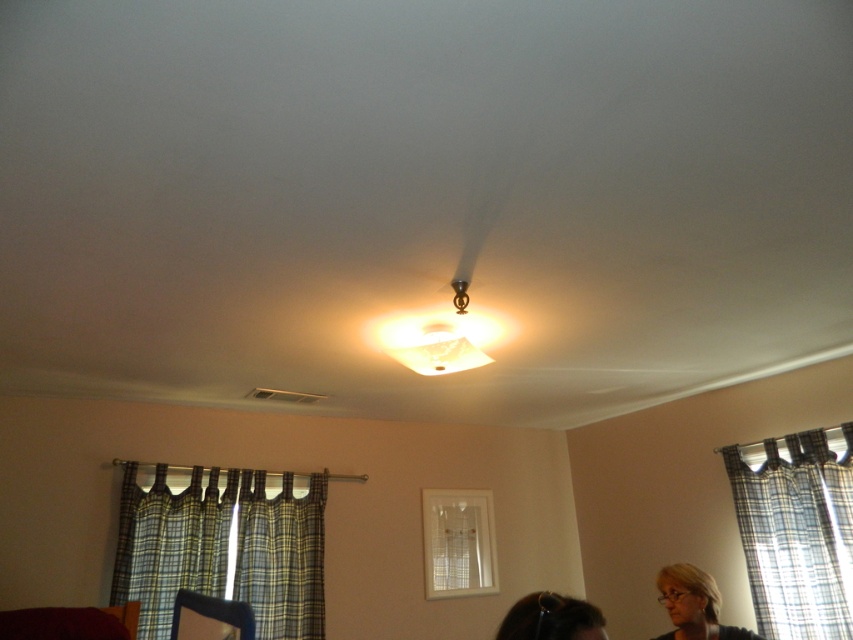
Is plaid fabric curtain at lower left positioned at the back of matte black hair at lower center?

Yes, it is behind matte black hair at lower center.

Does plaid fabric curtain at lower left have a lesser width compared to matte black hair at lower center?

Incorrect, plaid fabric curtain at lower left's width is not less than matte black hair at lower center's.

The width and height of the screenshot is (853, 640). In order to click on plaid fabric curtain at lower left in this screenshot , I will do `click(222, 548)`.

Consider the image. Is plaid fabric curtain at lower left to the right of matte black hair at lower right from the viewer's perspective?

No, plaid fabric curtain at lower left is not to the right of matte black hair at lower right.

Which is in front, point (314, 573) or point (694, 636)?

Positioned in front is point (694, 636).

I want to click on plaid fabric curtain at lower left, so click(222, 548).

This screenshot has width=853, height=640. In order to click on plaid fabric curtain at lower right in this screenshot , I will do `click(796, 534)`.

Who is more forward, (784, 470) or (675, 604)?

Positioned in front is point (675, 604).

At what (x,y) coordinates should I click in order to perform the action: click on plaid fabric curtain at lower right. Please return your answer as a coordinate pair (x, y). Looking at the image, I should click on (796, 534).